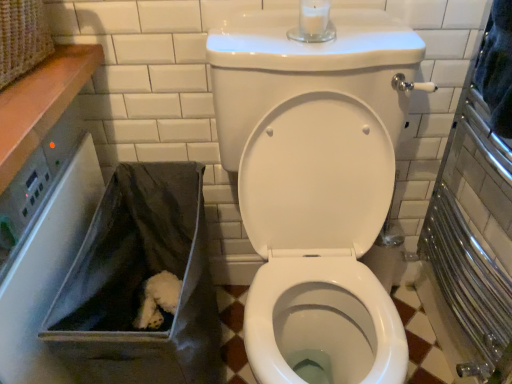
What do you see at coordinates (315, 166) in the screenshot?
I see `white glossy toilet at center` at bounding box center [315, 166].

Where is `white glossy toilet at center`? white glossy toilet at center is located at coordinates (315, 166).

Locate an element on the screen. Image resolution: width=512 pixels, height=384 pixels. gray fabric bag at lower left is located at coordinates (140, 284).

The image size is (512, 384). What do you see at coordinates (140, 284) in the screenshot?
I see `gray fabric bag at lower left` at bounding box center [140, 284].

Measure the distance between point (201, 321) and camera.

A distance of 3.62 feet exists between point (201, 321) and camera.

Where is `white glossy toilet at center`? The width and height of the screenshot is (512, 384). white glossy toilet at center is located at coordinates (315, 166).

Based on the photo, is gray fabric bag at lower left to the left or to the right of white glossy toilet at center in the image?

gray fabric bag at lower left is to the left of white glossy toilet at center.

Is gray fabric bag at lower left closer to the viewer compared to white glossy toilet at center?

No, it is not.

Does point (86, 345) lie in front of point (385, 116)?

Yes, point (86, 345) is in front of point (385, 116).

From the image's perspective, which is below, gray fabric bag at lower left or white glossy toilet at center?

From the image's view, gray fabric bag at lower left is below.

From a real-world perspective, is gray fabric bag at lower left on top of white glossy toilet at center?

Incorrect, from a real-world perspective, gray fabric bag at lower left is lower than white glossy toilet at center.

Considering the sizes of gray fabric bag at lower left and white glossy toilet at center in the image, is gray fabric bag at lower left wider or thinner than white glossy toilet at center?

gray fabric bag at lower left is thinner than white glossy toilet at center.

Is gray fabric bag at lower left taller or shorter than white glossy toilet at center?

Clearly, gray fabric bag at lower left is shorter compared to white glossy toilet at center.

Which of these two, gray fabric bag at lower left or white glossy toilet at center, is smaller?

Smaller between the two is gray fabric bag at lower left.

Looking at this image, would you say gray fabric bag at lower left is inside or outside white glossy toilet at center?

The correct answer is: outside.

Is there a large distance between gray fabric bag at lower left and white glossy toilet at center?

gray fabric bag at lower left is actually quite close to white glossy toilet at center.

Is gray fabric bag at lower left oriented towards white glossy toilet at center?

No, gray fabric bag at lower left is not turned towards white glossy toilet at center.

How many degrees apart are the facing directions of gray fabric bag at lower left and white glossy toilet at center?

gray fabric bag at lower left and white glossy toilet at center are facing 0.000149 degrees away from each other.

The height and width of the screenshot is (384, 512). Identify the location of toilet positioned vertically above the gray fabric bag at lower left (from a real-world perspective). (315, 166).

Which is more to the right, white glossy toilet at center or gray fabric bag at lower left?

Positioned to the right is white glossy toilet at center.

In the image, is white glossy toilet at center positioned in front of or behind gray fabric bag at lower left?

Visually, white glossy toilet at center is located in front of gray fabric bag at lower left.

Between point (284, 362) and point (178, 265), which one is positioned behind?

The point (178, 265) is behind.

From the image's perspective, relative to gray fabric bag at lower left, is white glossy toilet at center above or below?

Clearly, from the image's perspective, white glossy toilet at center is above gray fabric bag at lower left.

From a real-world perspective, is white glossy toilet at center on gray fabric bag at lower left?

Yes.

Which of these two, white glossy toilet at center or gray fabric bag at lower left, is thinner?

With smaller width is gray fabric bag at lower left.

Does white glossy toilet at center have a lesser height compared to gray fabric bag at lower left?

In fact, white glossy toilet at center may be taller than gray fabric bag at lower left.

Looking at the image, does white glossy toilet at center seem bigger or smaller compared to gray fabric bag at lower left?

white glossy toilet at center is bigger than gray fabric bag at lower left.

Is white glossy toilet at center inside or outside of gray fabric bag at lower left?

The correct answer is: outside.

Are white glossy toilet at center and gray fabric bag at lower left far apart?

white glossy toilet at center is actually quite close to gray fabric bag at lower left.

Could you tell me if white glossy toilet at center is turned towards gray fabric bag at lower left?

No.

Consider the image. How different are the orientations of white glossy toilet at center and gray fabric bag at lower left in degrees?

The facing directions of white glossy toilet at center and gray fabric bag at lower left are 0.000149 degrees apart.

This screenshot has height=384, width=512. Identify the location of toilet located on the right of gray fabric bag at lower left. (315, 166).

Where is `toilet above the gray fabric bag at lower left (from a real-world perspective)`? toilet above the gray fabric bag at lower left (from a real-world perspective) is located at coordinates (315, 166).

I want to click on recycling bin on the left side of white glossy toilet at center, so click(x=140, y=284).